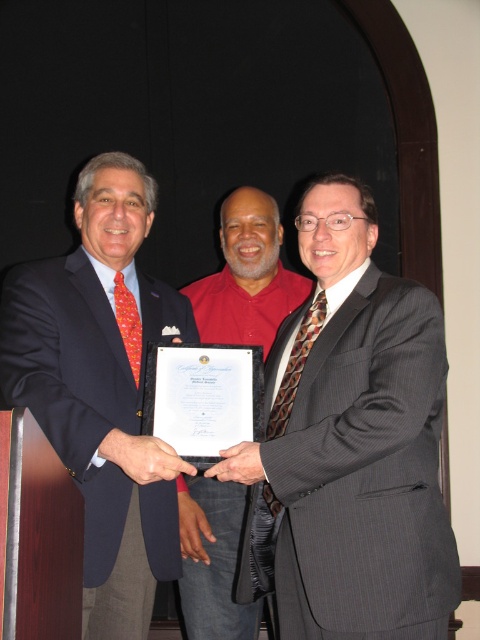
You are attending a formal event and notice two people in the image. One is wearing a navy blue suit jacket with a red tie, and the other is in a red button up shirt. There is also a point marked at coordinates (x=103, y=388). What color is the suit worn by the person located at this point?

The point at (x=103, y=388) corresponds to the matte black suit at center, so the suit is matte black.

You are standing in front of the group at the event. Which of the two people wearing the gray pinstripe suit at center or the matte red shirt at center is closer to you?

The gray pinstripe suit at center is closer to the viewer than the matte red shirt at center, so the person wearing the gray pinstripe suit at center is closer to you.

You are standing in front of the group holding the certificate at the event. Which of the two points, point (372, 218) or point (104, 387), is closer to you?

Point (372, 218) is further to the camera than point (104, 387), so the point closer to you is point (104, 387).